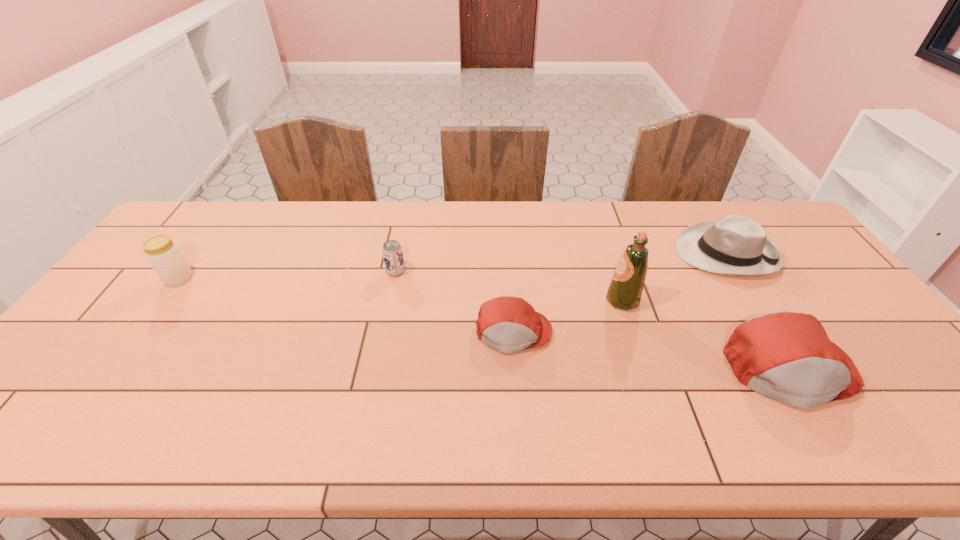
In the current image, all caps are evenly spaced. To maintain this equal spacing, where should an additional cap be placed on the left? Please point out a free spot. Please provide its 2D coordinates. Your answer should be formatted as a tuple, i.e. [(x, y)], where the tuple contains the x and y coordinates of a point satisfying the conditions above.

[(276, 300)]